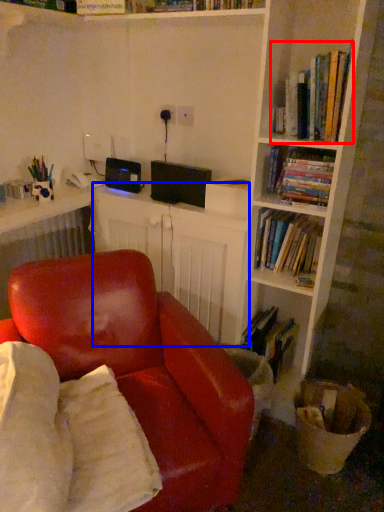
Question: Which object is further to the camera taking this photo, book (highlighted by a red box) or computer desk (highlighted by a blue box)?

Choices:
 (A) book
 (B) computer desk

Answer: (B)